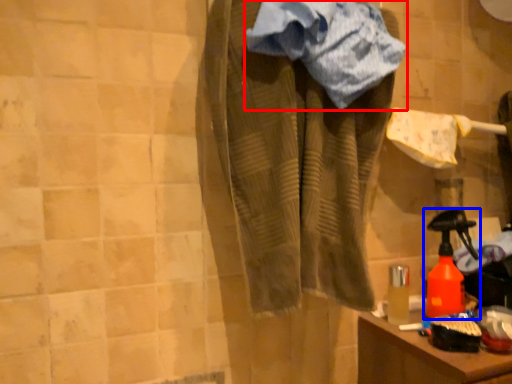
Question: Which of the following is the farthest to the observer, towel (highlighted by a red box) or bottle (highlighted by a blue box)?

Choices:
 (A) towel
 (B) bottle

Answer: (B)